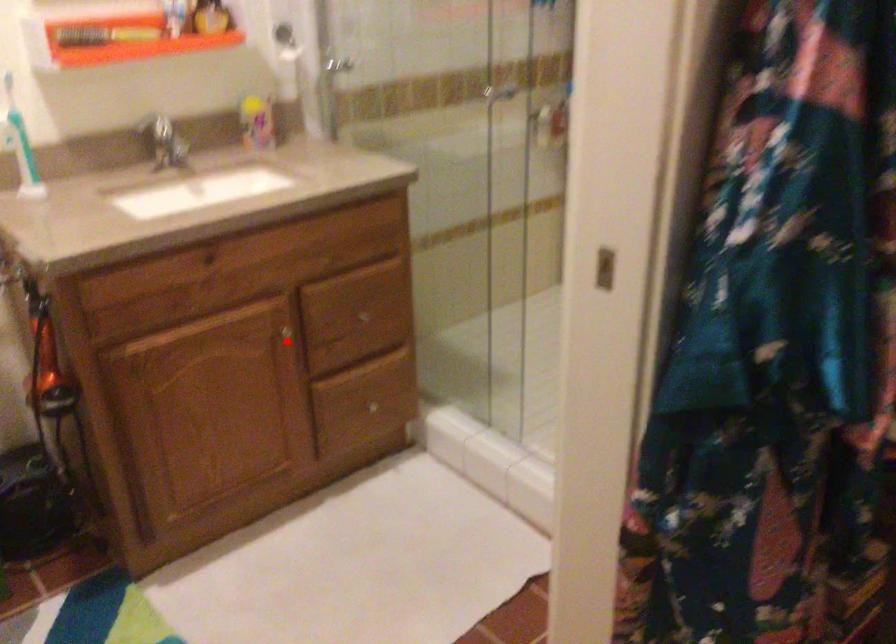
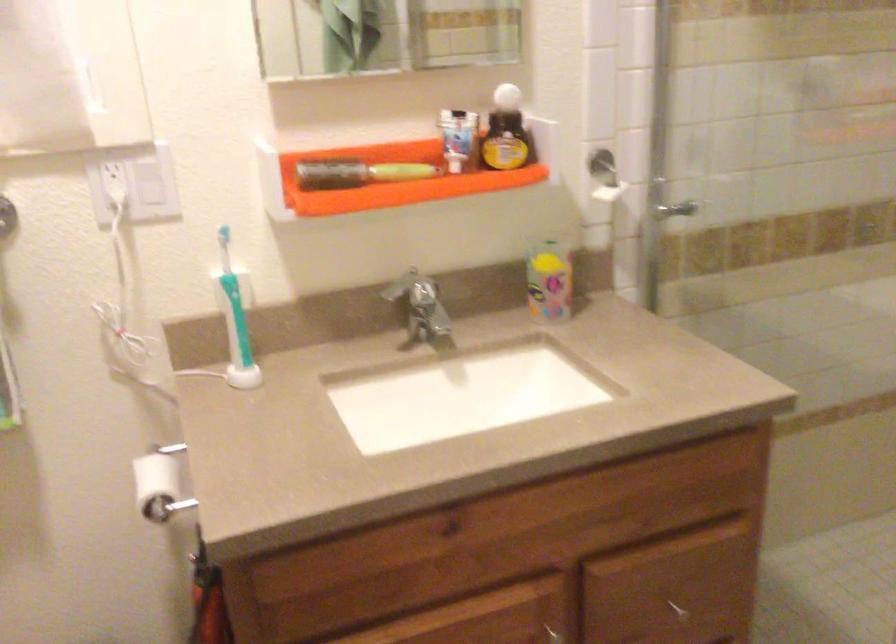
The point at the highlighted location is marked in the first image. Where is the corresponding point in the second image?

(555, 635)